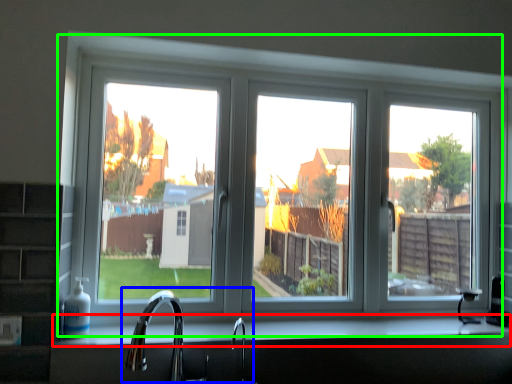
Question: Estimate the real-world distances between objects in this image. Which object is closer to counter top (highlighted by a red box), sink (highlighted by a blue box) or window (highlighted by a green box)?

Choices:
 (A) sink
 (B) window

Answer: (A)